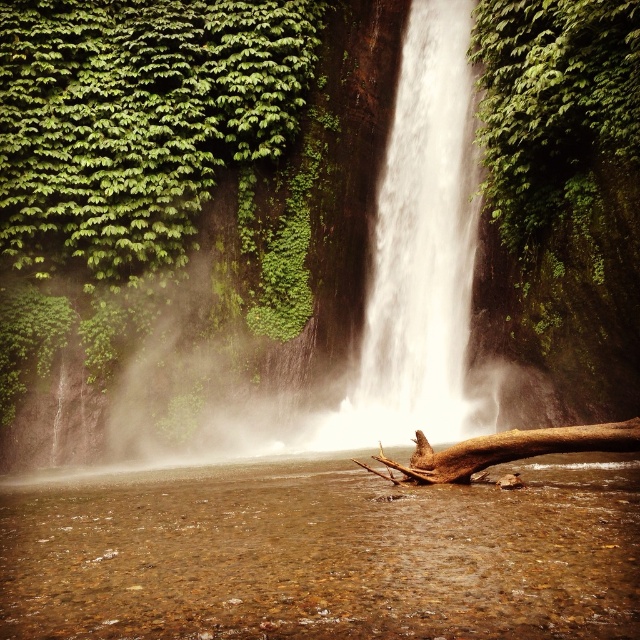
Measure the distance between green leafy tree at upper left and camera.

green leafy tree at upper left and camera are 18.58 meters apart from each other.

The image size is (640, 640). I want to click on green leafy tree at upper left, so click(x=138, y=116).

Who is taller, green leafy tree at upper left or white smooth waterfall at center?

Standing taller between the two is white smooth waterfall at center.

Is point (184, 45) farther from camera compared to point (413, 28)?

No, it is not.

Identify the location of green leafy tree at upper left. The height and width of the screenshot is (640, 640). (138, 116).

Measure the distance between white smooth waterfall at center and camera.

white smooth waterfall at center and camera are 62.87 feet apart.

Does point (420, 42) lie in front of point (515, 458)?

No, (420, 42) is further to viewer.

Locate an element on the screen. This screenshot has height=640, width=640. white smooth waterfall at center is located at coordinates (422, 250).

Locate an element on the screen. white smooth waterfall at center is located at coordinates (422, 250).